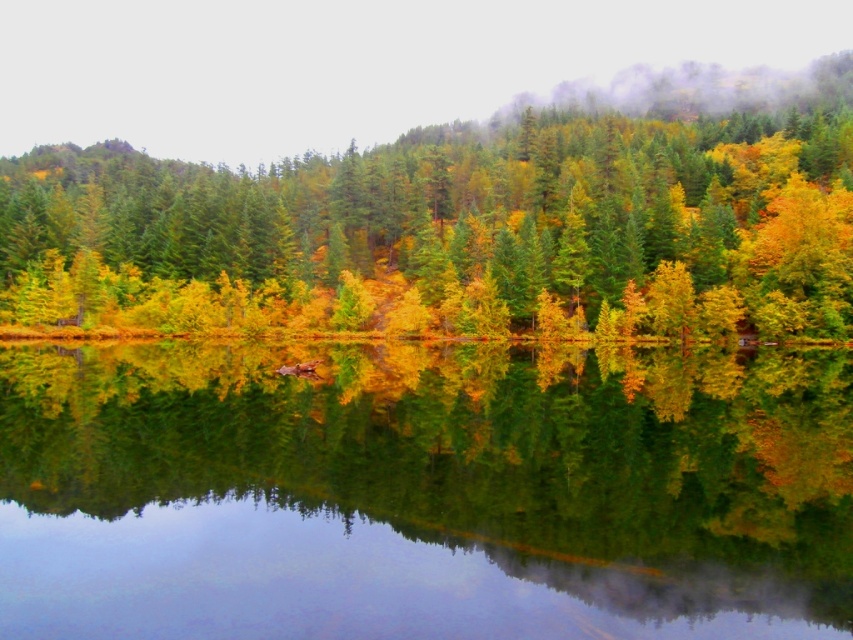
Who is positioned more to the left, transparent water at center or yellow-green foliage at center?

yellow-green foliage at center is more to the left.

Describe the element at coordinates (424, 492) in the screenshot. This screenshot has height=640, width=853. I see `transparent water at center` at that location.

This screenshot has width=853, height=640. Identify the location of transparent water at center. (424, 492).